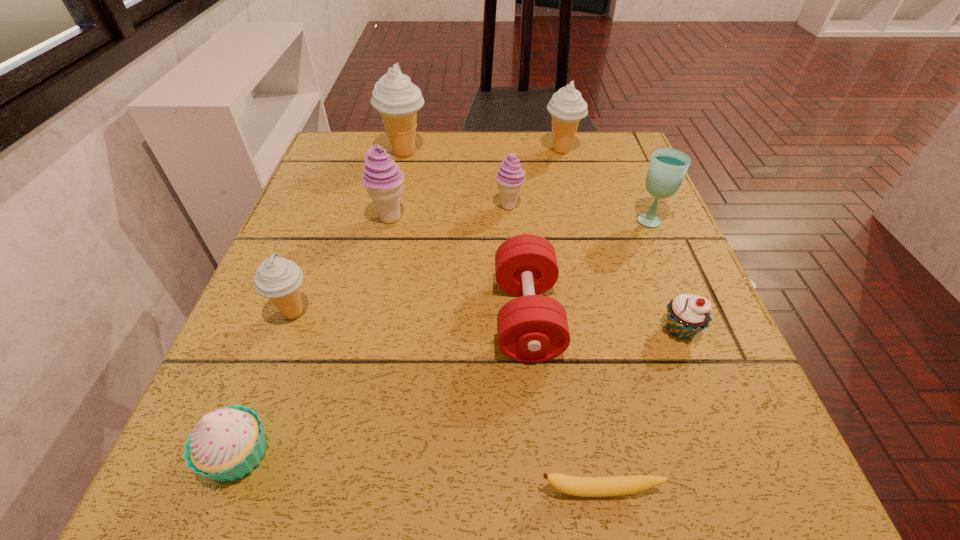
Where is `dumbbell`? This screenshot has height=540, width=960. dumbbell is located at coordinates (532, 328).

Locate an element on the screen. This screenshot has width=960, height=540. the right cupcake is located at coordinates (687, 315).

Image resolution: width=960 pixels, height=540 pixels. Identify the location of white cupcake. (226, 444).

The width and height of the screenshot is (960, 540). What are the coordinates of `the nearer cupcake` in the screenshot? It's located at (226, 444).

At what (x,y) coordinates should I click in order to perform the action: click on yellow banana. Please return your answer as a coordinate pair (x, y). Looking at the image, I should click on (616, 485).

This screenshot has height=540, width=960. In order to click on banana in this screenshot , I will do `click(616, 485)`.

Where is `free space located on the right of the tallest object`? free space located on the right of the tallest object is located at coordinates (526, 153).

Locate an element on the screen. free location located on the front of the rightmost beige icecream is located at coordinates (569, 182).

Where is `free space located on the front of the bigger purple icecream`? free space located on the front of the bigger purple icecream is located at coordinates 367,321.

Where is `free space located 0.060m on the front of the glass`? free space located 0.060m on the front of the glass is located at coordinates (664, 250).